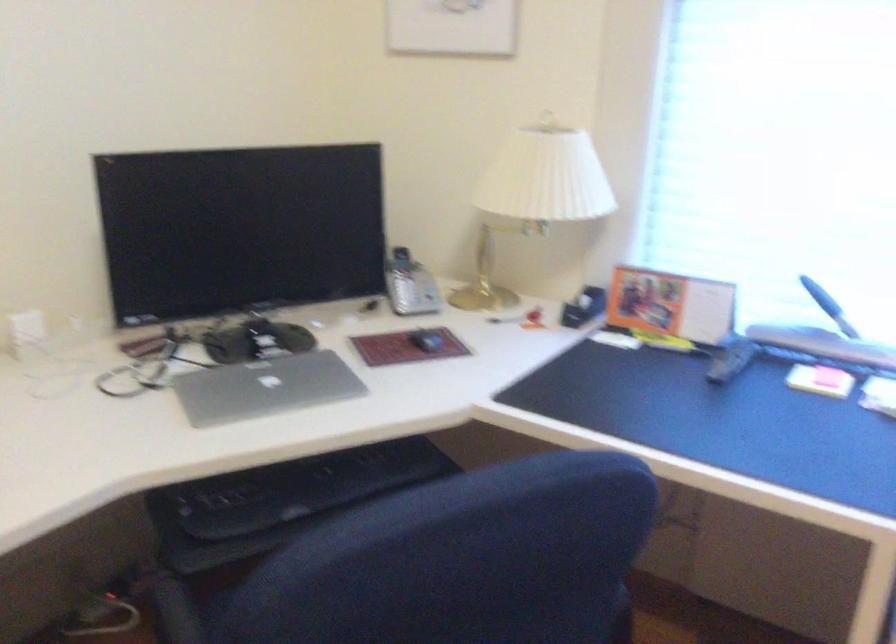
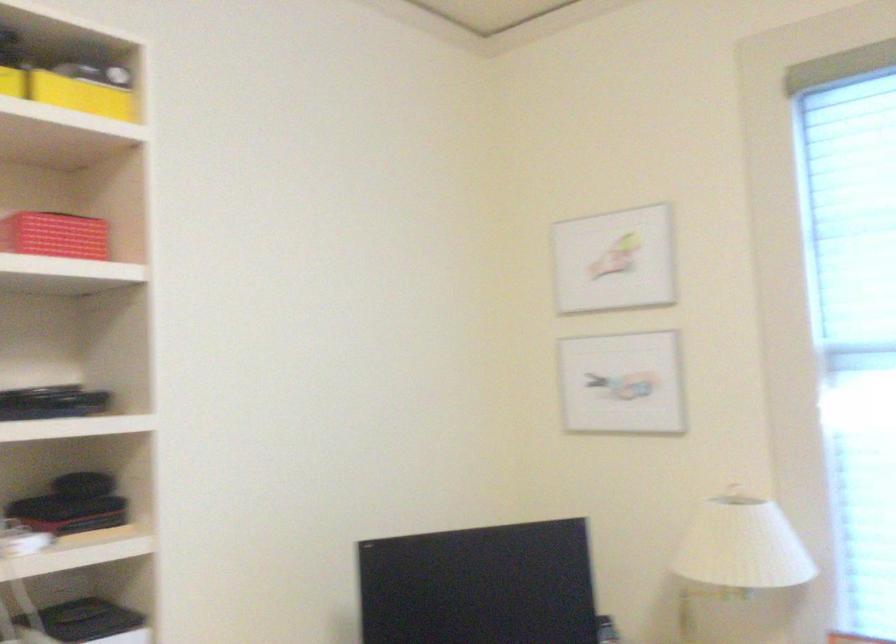
Question: The images are taken continuously from a first-person perspective. In which direction is your viewpoint rotating?

Choices:
 (A) Left
 (B) Right
 (C) Up
 (D) Down

Answer: (C)